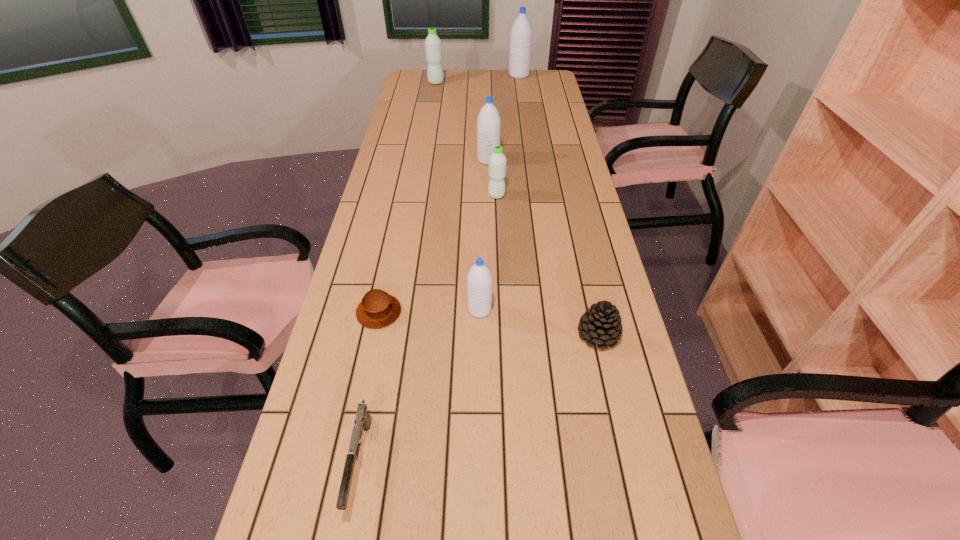
The image size is (960, 540). In order to click on free space located 0.170m at the narrow end of the sixth tallest object in this screenshot , I will do `click(617, 420)`.

Image resolution: width=960 pixels, height=540 pixels. Find the location of `vacant point located on the left of the brown muffin`. vacant point located on the left of the brown muffin is located at coordinates (337, 312).

This screenshot has height=540, width=960. I want to click on water bottle present at the left edge, so click(433, 48).

Identify the location of gun located in the left edge section of the desktop. (362, 421).

This screenshot has width=960, height=540. I want to click on muffin located in the left edge section of the desktop, so click(x=378, y=309).

Identify the location of water bottle that is at the right edge. Image resolution: width=960 pixels, height=540 pixels. (521, 32).

What are the coordinates of `pinecone that is positioned at the right edge` in the screenshot? It's located at (600, 325).

Find the location of `object positioned at the far left corner`. object positioned at the far left corner is located at coordinates (433, 48).

I want to click on object positioned at the far right corner, so click(521, 32).

You are a GUI agent. You are given a task and a screenshot of the screen. Output one action in this format:
    pyautogui.click(x=<x>, y=<y>)
    Task: Click on the vacant space at the far edge of the desktop
    The width and height of the screenshot is (960, 540).
    Given the screenshot: What is the action you would take?
    pyautogui.click(x=475, y=71)